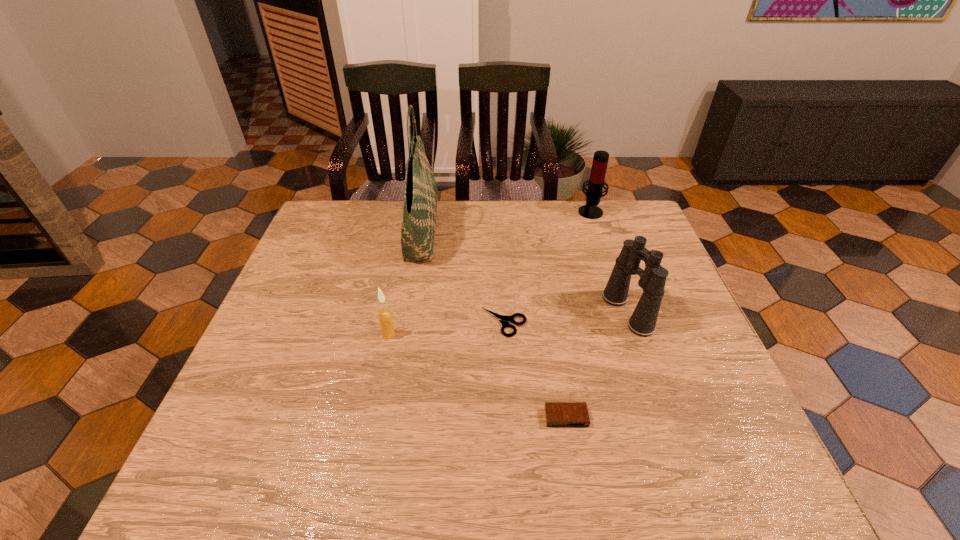
You are a GUI agent. You are given a task and a screenshot of the screen. Output one action in this format:
    pyautogui.click(x=<x>, y=<y>)
    Task: Click on the free space between the fifth tallest object and the fourth tallest object
    
    Given the screenshot: What is the action you would take?
    pyautogui.click(x=477, y=376)

At what (x,y) coordinates should I click in order to perform the action: click on object that is the fourth nearest to the tallest object. Please return your answer as a coordinate pair (x, y). The height and width of the screenshot is (540, 960). Looking at the image, I should click on (652, 280).

This screenshot has height=540, width=960. In order to click on the fourth closest object to the microphone in this screenshot , I will do `click(558, 414)`.

Locate an element on the screen. free location that satisfies the following two spatial constraints: 1. on the back side of the tallest object; 2. on the right side of the microphone is located at coordinates (425, 211).

Image resolution: width=960 pixels, height=540 pixels. I want to click on blank space that satisfies the following two spatial constraints: 1. on the front side of the tote bag; 2. on the right side of the binoculars, so click(408, 312).